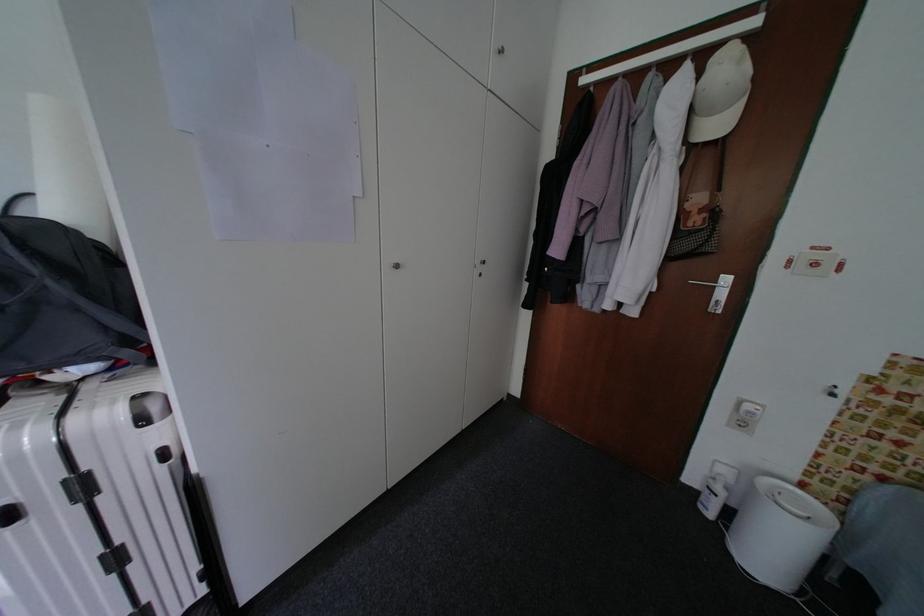
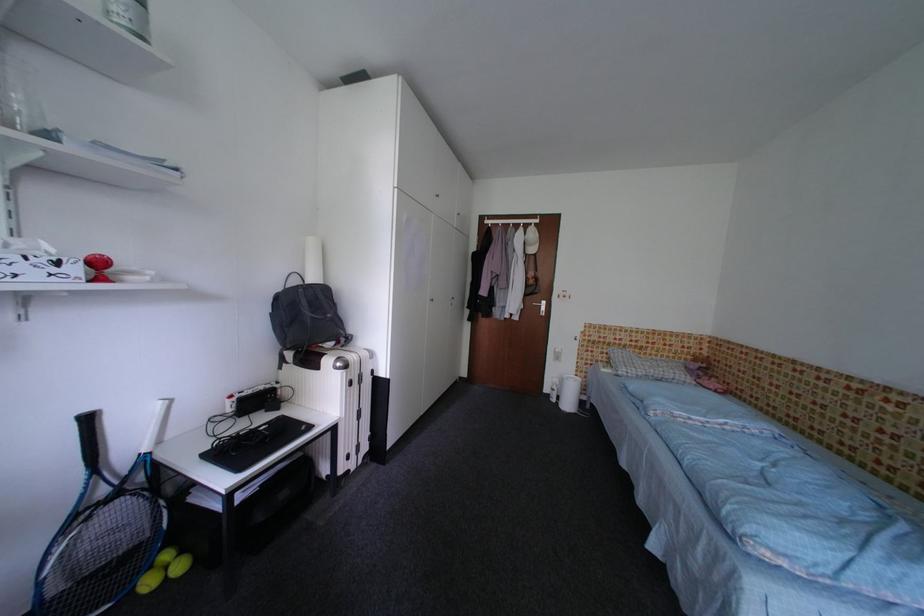
Where in the second image is the point corresponding to [694,73] from the first image?

(529, 232)